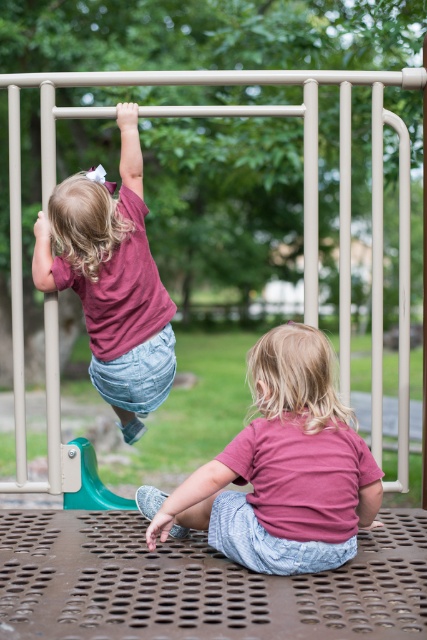
Can you confirm if pink fabric shirt at lower center is positioned below matte pink shirt at upper left?

Yes, pink fabric shirt at lower center is below matte pink shirt at upper left.

Between point (240, 476) and point (44, 225), which one is positioned behind?

The point (44, 225) is behind.

Describe the element at coordinates (280, 468) in the screenshot. This screenshot has width=427, height=640. I see `pink fabric shirt at lower center` at that location.

You are a GUI agent. You are given a task and a screenshot of the screen. Output one action in this format:
    pyautogui.click(x=<x>, y=<y>)
    Task: Click on the pink fabric shirt at lower center
    This screenshot has height=640, width=427.
    Given the screenshot: What is the action you would take?
    pyautogui.click(x=280, y=468)